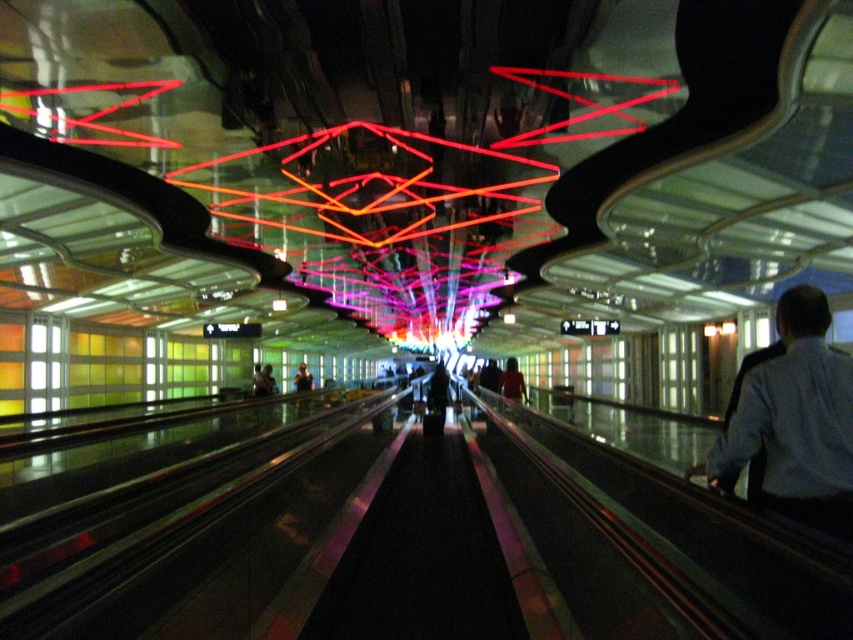
You are a traveler in the transportation hub and you see the light blue shirt at right and the matte black jacket at center. Which one is positioned more to the left side of the scene?

The light blue shirt at right is positioned more to the left side of the scene than the matte black jacket at center.

You are a security guard in the transportation hub and need to check both the light blue shirt at right and the matte black jacket at center. Given that your patrol route requires you to walk in a straight line from your current position, can you reach both objects without deviating from your path?

The light blue shirt at right and matte black jacket at center are 50.10 feet apart. Since they are positioned along your straight path, you can reach both without deviating as long as your route covers the entire 50.10 feet distance between them.